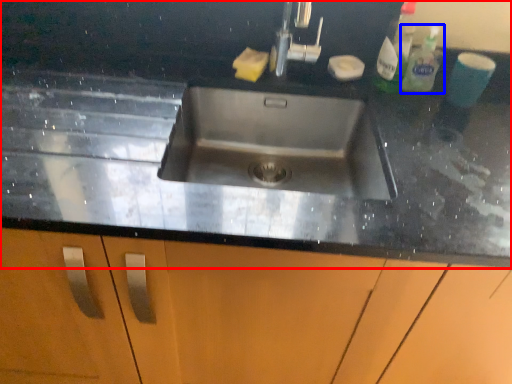
Question: Which object appears closest to the camera in this image, countertop (highlighted by a red box) or cleaning product (highlighted by a blue box)?

Choices:
 (A) countertop
 (B) cleaning product

Answer: (A)